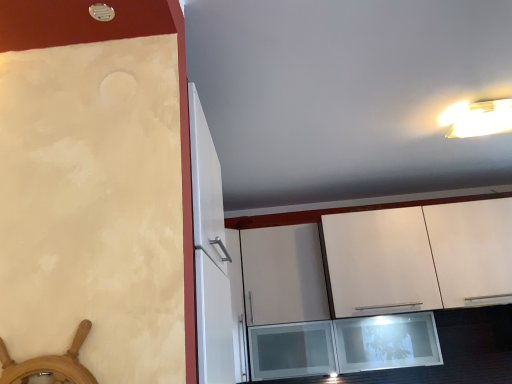
I want to click on white matte cabinet at upper center, so click(420, 257).

What do you see at coordinates (420, 257) in the screenshot?
I see `white matte cabinet at upper center` at bounding box center [420, 257].

Based on the photo, measure the distance between white plastic light fixture at upper right and camera.

white plastic light fixture at upper right is 5.85 feet from camera.

In order to face white plastic light fixture at upper right, should I rotate leftwards or rightwards?

Rotate your view right by about 28.962°.

This screenshot has width=512, height=384. In order to click on white plastic light fixture at upper right in this screenshot , I will do [x=483, y=119].

The image size is (512, 384). What do you see at coordinates (483, 119) in the screenshot?
I see `white plastic light fixture at upper right` at bounding box center [483, 119].

This screenshot has width=512, height=384. In order to click on white matte cabinet at upper center in this screenshot , I will do click(x=420, y=257).

Is white matte cabinet at upper center to the right of white plastic light fixture at upper right from the viewer's perspective?

No, white matte cabinet at upper center is not to the right of white plastic light fixture at upper right.

Who is more distant, white matte cabinet at upper center or white plastic light fixture at upper right?

white matte cabinet at upper center is behind.

Considering the points (368, 301) and (470, 113), which point is behind, point (368, 301) or point (470, 113)?

Point (368, 301)

From the image's perspective, is white matte cabinet at upper center over white plastic light fixture at upper right?

No, from the image's perspective, white matte cabinet at upper center is not on top of white plastic light fixture at upper right.

From a real-world perspective, is white matte cabinet at upper center located beneath white plastic light fixture at upper right?

Indeed, from a real-world perspective, white matte cabinet at upper center is positioned beneath white plastic light fixture at upper right.

Which object is thinner, white matte cabinet at upper center or white plastic light fixture at upper right?

Thinner between the two is white plastic light fixture at upper right.

Which of these two, white matte cabinet at upper center or white plastic light fixture at upper right, stands taller?

Standing taller between the two is white matte cabinet at upper center.

Considering the sizes of white matte cabinet at upper center and white plastic light fixture at upper right in the image, is white matte cabinet at upper center bigger or smaller than white plastic light fixture at upper right?

In the image, white matte cabinet at upper center appears to be larger than white plastic light fixture at upper right.

Can white plastic light fixture at upper right be found inside white matte cabinet at upper center?

No, white plastic light fixture at upper right is located outside of white matte cabinet at upper center.

Is white matte cabinet at upper center not near white plastic light fixture at upper right?

No.

Is white matte cabinet at upper center oriented away from white plastic light fixture at upper right?

No, white matte cabinet at upper center is not facing the opposite direction of white plastic light fixture at upper right.

From the picture: How different are the orientations of white matte cabinet at upper center and white plastic light fixture at upper right in degrees?

The facing directions of white matte cabinet at upper center and white plastic light fixture at upper right are 0.184 degrees apart.

Locate an element on the screen. light fixture that appears above the white matte cabinet at upper center (from the image's perspective) is located at coordinates coord(483,119).

Which object is positioned more to the left, white plastic light fixture at upper right or white matte cabinet at upper center?

white matte cabinet at upper center is more to the left.

Is white plastic light fixture at upper right positioned in front of white matte cabinet at upper center?

Yes, white plastic light fixture at upper right is in front of white matte cabinet at upper center.

Does point (461, 131) come behind point (495, 251)?

No, it is in front of (495, 251).

From the image's perspective, would you say white plastic light fixture at upper right is positioned over white matte cabinet at upper center?

Yes.

From a real-world perspective, is white plastic light fixture at upper right positioned above or below white matte cabinet at upper center?

In terms of real-world spatial position, white plastic light fixture at upper right is above white matte cabinet at upper center.

Considering the sizes of white plastic light fixture at upper right and white matte cabinet at upper center in the image, is white plastic light fixture at upper right wider or thinner than white matte cabinet at upper center?

Considering their sizes, white plastic light fixture at upper right looks slimmer than white matte cabinet at upper center.

In terms of height, does white plastic light fixture at upper right look taller or shorter compared to white matte cabinet at upper center?

white plastic light fixture at upper right is shorter than white matte cabinet at upper center.

Based on their sizes in the image, would you say white plastic light fixture at upper right is bigger or smaller than white matte cabinet at upper center?

In the image, white plastic light fixture at upper right appears to be smaller than white matte cabinet at upper center.

Can we say white plastic light fixture at upper right lies outside white matte cabinet at upper center?

That's correct, white plastic light fixture at upper right is outside of white matte cabinet at upper center.

Is white plastic light fixture at upper right with white matte cabinet at upper center?

white plastic light fixture at upper right and white matte cabinet at upper center are not in contact.

Does white plastic light fixture at upper right turn towards white matte cabinet at upper center?

No.

Image resolution: width=512 pixels, height=384 pixels. I want to click on light fixture above the white matte cabinet at upper center (from a real-world perspective), so click(x=483, y=119).

The width and height of the screenshot is (512, 384). What are the coordinates of `light fixture on the right of white matte cabinet at upper center` in the screenshot? It's located at (483, 119).

At what (x,y) coordinates should I click in order to perform the action: click on light fixture in front of the white matte cabinet at upper center. Please return your answer as a coordinate pair (x, y). The image size is (512, 384). Looking at the image, I should click on (483, 119).